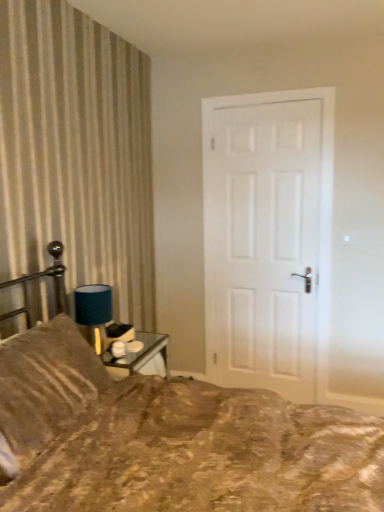
The height and width of the screenshot is (512, 384). Identify the location of empty space that is ontop of white matte door at center (from a real-world perspective). (271, 99).